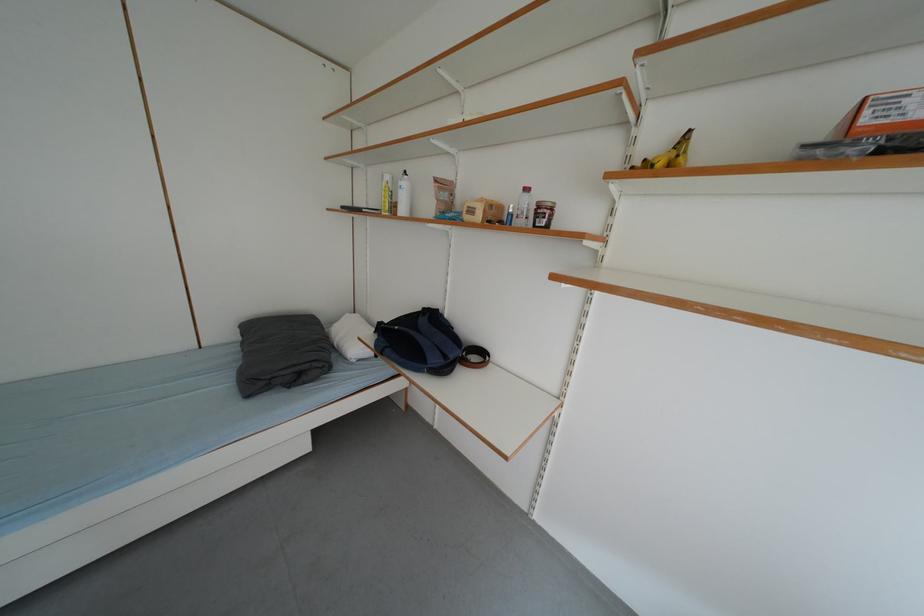
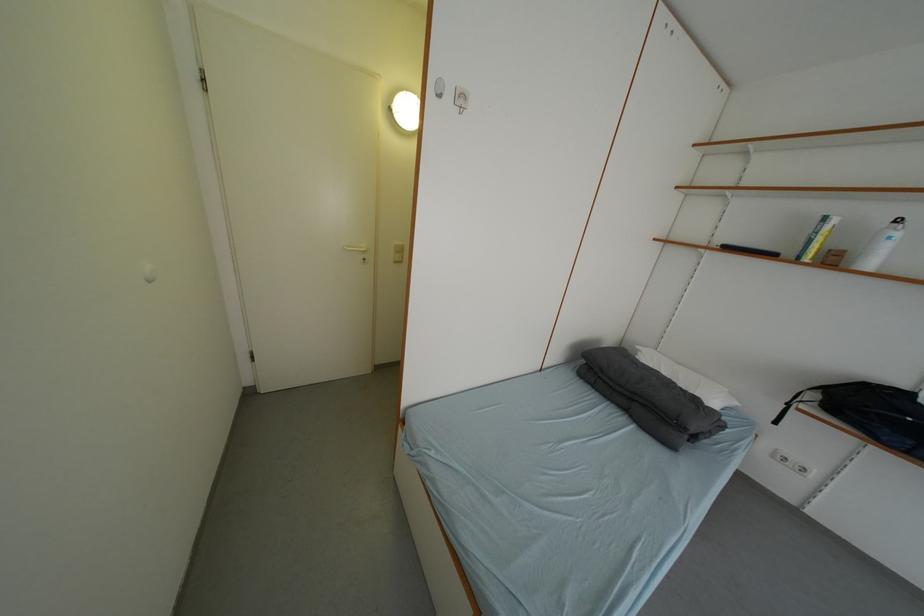
Question: In a continuous first-person perspective shot, in which direction is the camera moving?

Choices:
 (A) Left
 (B) Right
 (C) Forward
 (D) Backward

Answer: (A)